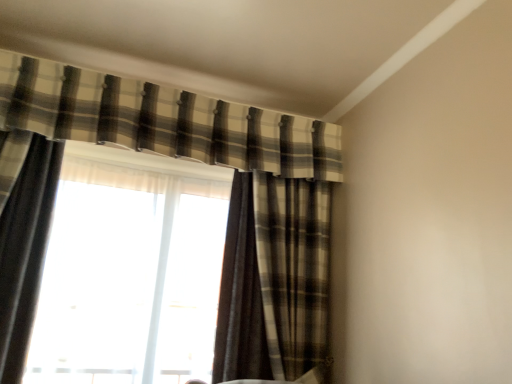
The width and height of the screenshot is (512, 384). What do you see at coordinates (163, 120) in the screenshot?
I see `plaid fabric curtain at upper center, marked as the 2th curtain in a left-to-right arrangement` at bounding box center [163, 120].

Find the location of `translucent fabric at center`. translucent fabric at center is located at coordinates (129, 277).

Describe the element at coordinates (275, 281) in the screenshot. This screenshot has width=512, height=384. I see `brown plaid curtain at center, the 1th curtain when ordered from right to left` at that location.

What are the coordinates of `plaid fabric curtain at left, the 1th curtain when ordered from left to right` in the screenshot? It's located at (25, 251).

The height and width of the screenshot is (384, 512). Describe the element at coordinates (25, 251) in the screenshot. I see `plaid fabric curtain at left, the 1th curtain when ordered from left to right` at that location.

In order to click on plaid fabric curtain at upper center, which is counted as the 2th curtain, starting from the right in this screenshot , I will do `click(163, 120)`.

Can you see plaid fabric curtain at upper center, marked as the 2th curtain in a left-to-right arrangement, touching translucent fabric at center?

They are not placed beside each other.

Who is smaller, plaid fabric curtain at upper center, which is counted as the 2th curtain, starting from the right, or translucent fabric at center?

With smaller size is plaid fabric curtain at upper center, which is counted as the 2th curtain, starting from the right.

The image size is (512, 384). In order to click on window that is below the plaid fabric curtain at upper center, marked as the 2th curtain in a left-to-right arrangement (from the image's perspective) in this screenshot , I will do `click(129, 277)`.

Between point (66, 173) and point (34, 82), which one is positioned in front?

Point (34, 82)

Which is correct: translucent fabric at center is inside plaid fabric curtain at upper center, which is counted as the 2th curtain, starting from the right, or outside of it?

translucent fabric at center exists outside the volume of plaid fabric curtain at upper center, which is counted as the 2th curtain, starting from the right.

Between plaid fabric curtain at upper center, which is counted as the 2th curtain, starting from the right, and brown plaid curtain at center, the 1th curtain when ordered from right to left, which one appears on the left side from the viewer's perspective?

From the viewer's perspective, plaid fabric curtain at upper center, which is counted as the 2th curtain, starting from the right, appears more on the left side.

At what (x,y) coordinates should I click in order to perform the action: click on the 2nd curtain positioned below the plaid fabric curtain at upper center, which is counted as the 2th curtain, starting from the right (from the image's perspective). Please return your answer as a coordinate pair (x, y). Looking at the image, I should click on coord(275,281).

Between plaid fabric curtain at upper center, marked as the 2th curtain in a left-to-right arrangement, and brown plaid curtain at center, acting as the 3th curtain starting from the left, which one is positioned in front?

plaid fabric curtain at upper center, marked as the 2th curtain in a left-to-right arrangement, is more forward.

Could brown plaid curtain at center, acting as the 3th curtain starting from the left, be considered to be inside plaid fabric curtain at upper center, marked as the 2th curtain in a left-to-right arrangement?

No, brown plaid curtain at center, acting as the 3th curtain starting from the left, is not a part of plaid fabric curtain at upper center, marked as the 2th curtain in a left-to-right arrangement.

Looking at the image, does brown plaid curtain at center, acting as the 3th curtain starting from the left, seem bigger or smaller compared to plaid fabric curtain at left, arranged as the third curtain when viewed from the right?

In the image, brown plaid curtain at center, acting as the 3th curtain starting from the left, appears to be larger than plaid fabric curtain at left, arranged as the third curtain when viewed from the right.

Is brown plaid curtain at center, the 1th curtain when ordered from right to left, not near plaid fabric curtain at left, the 1th curtain when ordered from left to right?

Yes.

Which of these two, brown plaid curtain at center, the 1th curtain when ordered from right to left, or plaid fabric curtain at left, the 1th curtain when ordered from left to right, is wider?

With larger width is brown plaid curtain at center, the 1th curtain when ordered from right to left.

Is point (109, 167) closer to viewer compared to point (51, 170)?

No, (109, 167) is behind (51, 170).

From the image's perspective, is translucent fabric at center under plaid fabric curtain at left, arranged as the third curtain when viewed from the right?

Yes, from the image's perspective, translucent fabric at center is below plaid fabric curtain at left, arranged as the third curtain when viewed from the right.

Can you confirm if translucent fabric at center is thinner than plaid fabric curtain at left, arranged as the third curtain when viewed from the right?

Indeed, translucent fabric at center has a lesser width compared to plaid fabric curtain at left, arranged as the third curtain when viewed from the right.

Based on their sizes in the image, would you say plaid fabric curtain at left, the 1th curtain when ordered from left to right, is bigger or smaller than translucent fabric at center?

Considering their sizes, plaid fabric curtain at left, the 1th curtain when ordered from left to right, takes up less space than translucent fabric at center.

From the image's perspective, between plaid fabric curtain at left, the 1th curtain when ordered from left to right, and translucent fabric at center, which one is located above?

plaid fabric curtain at left, the 1th curtain when ordered from left to right, from the image's perspective.

Between plaid fabric curtain at left, the 1th curtain when ordered from left to right, and translucent fabric at center, which one is positioned behind?

Positioned behind is translucent fabric at center.

Consider the image. Is plaid fabric curtain at left, arranged as the third curtain when viewed from the right, at the right side of translucent fabric at center?

Incorrect, plaid fabric curtain at left, arranged as the third curtain when viewed from the right, is not on the right side of translucent fabric at center.

Could you measure the distance between plaid fabric curtain at left, the 1th curtain when ordered from left to right, and brown plaid curtain at center, the 1th curtain when ordered from right to left?

1.08 meters.

Is plaid fabric curtain at left, the 1th curtain when ordered from left to right, at the right side of brown plaid curtain at center, acting as the 3th curtain starting from the left?

Incorrect, plaid fabric curtain at left, the 1th curtain when ordered from left to right, is not on the right side of brown plaid curtain at center, acting as the 3th curtain starting from the left.

Who is smaller, plaid fabric curtain at left, arranged as the third curtain when viewed from the right, or brown plaid curtain at center, the 1th curtain when ordered from right to left?

Smaller between the two is plaid fabric curtain at left, arranged as the third curtain when viewed from the right.

Can you tell me how much plaid fabric curtain at left, arranged as the third curtain when viewed from the right, and brown plaid curtain at center, the 1th curtain when ordered from right to left, differ in facing direction?

They differ by 0.00011 degrees in their facing directions.

This screenshot has width=512, height=384. What are the coordinates of `the 1st curtain behind the translucent fabric at center` in the screenshot? It's located at (163, 120).

Find the location of `window in front of the plaid fabric curtain at upper center, which is counted as the 2th curtain, starting from the right`. window in front of the plaid fabric curtain at upper center, which is counted as the 2th curtain, starting from the right is located at coordinates (129, 277).

When comparing their distances from translucent fabric at center, does plaid fabric curtain at upper center, which is counted as the 2th curtain, starting from the right, or brown plaid curtain at center, acting as the 3th curtain starting from the left, seem further?

plaid fabric curtain at upper center, which is counted as the 2th curtain, starting from the right, lies further to translucent fabric at center than the other object.

Considering their positions, is plaid fabric curtain at upper center, which is counted as the 2th curtain, starting from the right, positioned further to brown plaid curtain at center, the 1th curtain when ordered from right to left, than plaid fabric curtain at left, arranged as the third curtain when viewed from the right?

The object further to brown plaid curtain at center, the 1th curtain when ordered from right to left, is plaid fabric curtain at left, arranged as the third curtain when viewed from the right.

When comparing their distances from plaid fabric curtain at upper center, marked as the 2th curtain in a left-to-right arrangement, does plaid fabric curtain at left, arranged as the third curtain when viewed from the right, or brown plaid curtain at center, the 1th curtain when ordered from right to left, seem closer?

Based on the image, brown plaid curtain at center, the 1th curtain when ordered from right to left, appears to be nearer to plaid fabric curtain at upper center, marked as the 2th curtain in a left-to-right arrangement.

Looking at the image, which one is located closer to translucent fabric at center, brown plaid curtain at center, acting as the 3th curtain starting from the left, or plaid fabric curtain at upper center, which is counted as the 2th curtain, starting from the right?

Based on the image, brown plaid curtain at center, acting as the 3th curtain starting from the left, appears to be nearer to translucent fabric at center.

When comparing their distances from translucent fabric at center, does plaid fabric curtain at left, arranged as the third curtain when viewed from the right, or brown plaid curtain at center, the 1th curtain when ordered from right to left, seem further?

brown plaid curtain at center, the 1th curtain when ordered from right to left, is positioned further to the anchor translucent fabric at center.

Estimate the real-world distances between objects in this image. Which object is closer to plaid fabric curtain at left, arranged as the third curtain when viewed from the right, translucent fabric at center or plaid fabric curtain at upper center, marked as the 2th curtain in a left-to-right arrangement?

The object closer to plaid fabric curtain at left, arranged as the third curtain when viewed from the right, is translucent fabric at center.

Estimate the real-world distances between objects in this image. Which object is further from brown plaid curtain at center, acting as the 3th curtain starting from the left, plaid fabric curtain at upper center, which is counted as the 2th curtain, starting from the right, or translucent fabric at center?

plaid fabric curtain at upper center, which is counted as the 2th curtain, starting from the right, is further to brown plaid curtain at center, acting as the 3th curtain starting from the left.

Based on their spatial positions, is plaid fabric curtain at left, the 1th curtain when ordered from left to right, or translucent fabric at center closer to plaid fabric curtain at upper center, marked as the 2th curtain in a left-to-right arrangement?

translucent fabric at center is positioned closer to the anchor plaid fabric curtain at upper center, marked as the 2th curtain in a left-to-right arrangement.

I want to click on curtain between plaid fabric curtain at left, arranged as the third curtain when viewed from the right, and brown plaid curtain at center, the 1th curtain when ordered from right to left, from left to right, so click(x=163, y=120).

This screenshot has width=512, height=384. Identify the location of window located between plaid fabric curtain at left, arranged as the third curtain when viewed from the right, and brown plaid curtain at center, acting as the 3th curtain starting from the left, in the left-right direction. (129, 277).

At what (x,y) coordinates should I click in order to perform the action: click on window situated between plaid fabric curtain at left, arranged as the third curtain when viewed from the right, and plaid fabric curtain at upper center, marked as the 2th curtain in a left-to-right arrangement, from left to right. Please return your answer as a coordinate pair (x, y). The image size is (512, 384). Looking at the image, I should click on (129, 277).

Locate an element on the screen. This screenshot has height=384, width=512. window between plaid fabric curtain at upper center, which is counted as the 2th curtain, starting from the right, and brown plaid curtain at center, acting as the 3th curtain starting from the left, in the up-down direction is located at coordinates (129, 277).